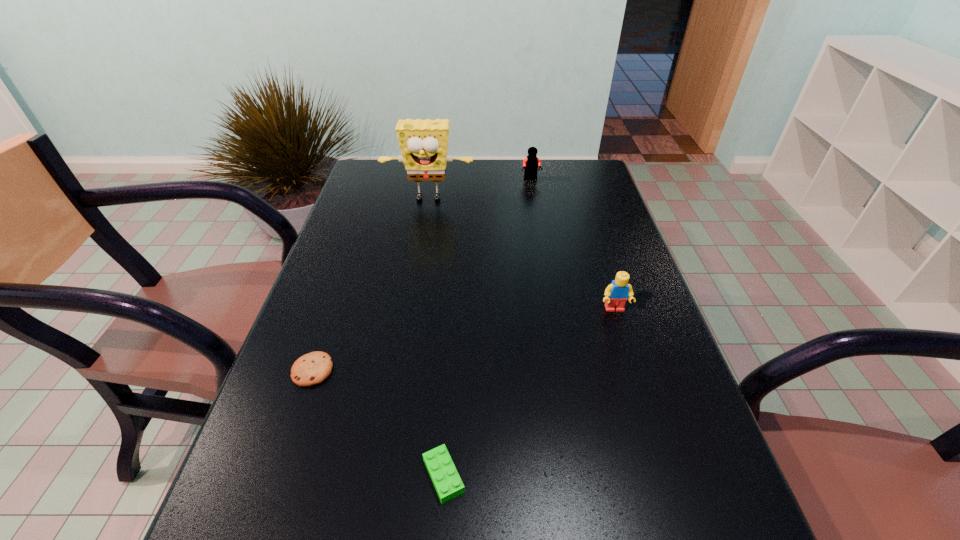
Identify the location of empty space between the nearest object and the second object from right to left. (488, 327).

You are a GUI agent. You are given a task and a screenshot of the screen. Output one action in this format:
    pyautogui.click(x=<x>, y=<y>)
    Task: Click on the vacant region between the tallest object and the nearest object
    Image resolution: width=960 pixels, height=540 pixels.
    Given the screenshot: What is the action you would take?
    pyautogui.click(x=436, y=338)

The width and height of the screenshot is (960, 540). I want to click on vacant space that is in between the second shortest object and the fourth object from left to right, so click(x=488, y=327).

Image resolution: width=960 pixels, height=540 pixels. Identify the location of vacant space in between the cookie and the fourth nearest object. (371, 285).

The image size is (960, 540). What are the coordinates of `empty location between the nearest object and the second nearest object` in the screenshot? It's located at (378, 423).

The height and width of the screenshot is (540, 960). Find the location of `object that is the second nearest to the fourth nearest object`. object that is the second nearest to the fourth nearest object is located at coordinates (616, 294).

Choose which object is the second nearest neighbor to the tallest object. Please provide its 2D coordinates. Your answer should be formatted as a tuple, i.e. [(x, y)], where the tuple contains the x and y coordinates of a point satisfying the conditions above.

[(616, 294)]

Identify which Lego is the second closest to the third nearest object. Please provide its 2D coordinates. Your answer should be formatted as a tuple, i.e. [(x, y)], where the tuple contains the x and y coordinates of a point satisfying the conditions above.

[(532, 162)]

I want to click on Lego that can be found as the second closest to the third nearest object, so click(x=532, y=162).

Identify the location of vacant region that satisfies the following two spatial constraints: 1. on the front-facing side of the second farthest object; 2. on the left side of the leftmost Lego. (384, 476).